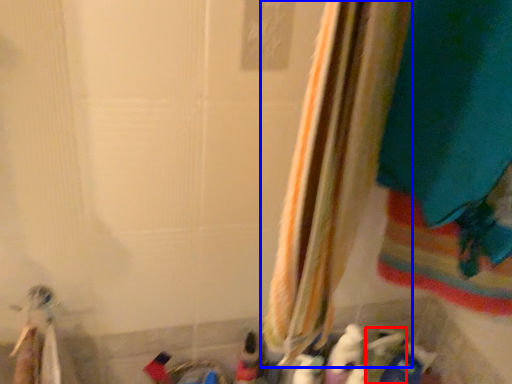
Question: Which point is further to the camera, toy (highlighted by a red box) or curtain (highlighted by a blue box)?

Choices:
 (A) toy
 (B) curtain

Answer: (A)